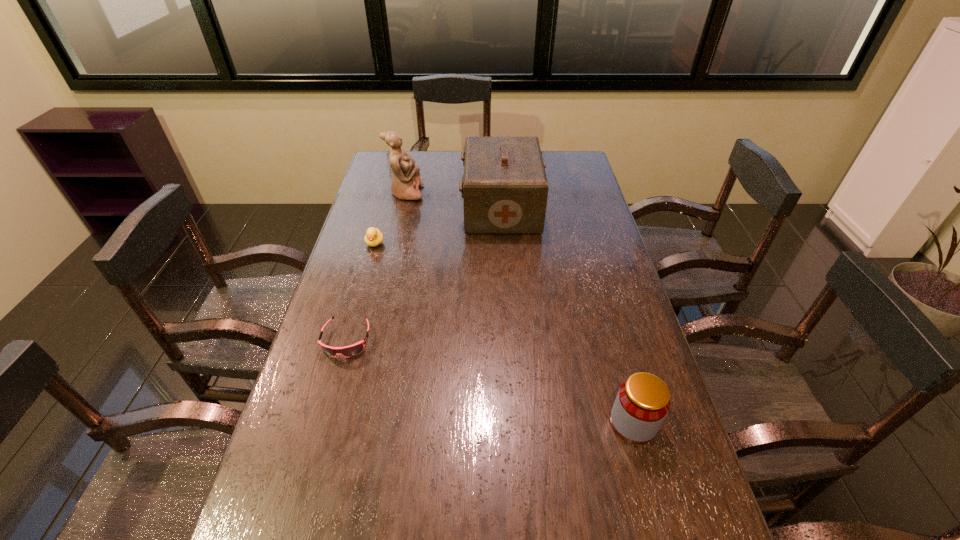
The height and width of the screenshot is (540, 960). Identify the location of free location located on the beak of the duckling. (359, 300).

Where is `free location located on the front-facing side of the shortest object`? The width and height of the screenshot is (960, 540). free location located on the front-facing side of the shortest object is located at coordinates (317, 444).

Identify the location of figurine present at the left edge. (405, 184).

Identify the location of duckling that is at the left edge. (373, 237).

Where is `goggles that is at the left edge`? goggles that is at the left edge is located at coordinates 348,351.

Locate an element on the screen. object that is at the right edge is located at coordinates (643, 400).

Identify the location of free spot at the far edge of the desktop. The width and height of the screenshot is (960, 540). (442, 153).

Locate an element on the screen. The width and height of the screenshot is (960, 540). free space at the left edge of the desktop is located at coordinates (391, 207).

I want to click on blank space at the right edge of the desktop, so click(609, 267).

In the image, there is a desktop. Where is `free space at the far left corner`? The width and height of the screenshot is (960, 540). free space at the far left corner is located at coordinates (388, 172).